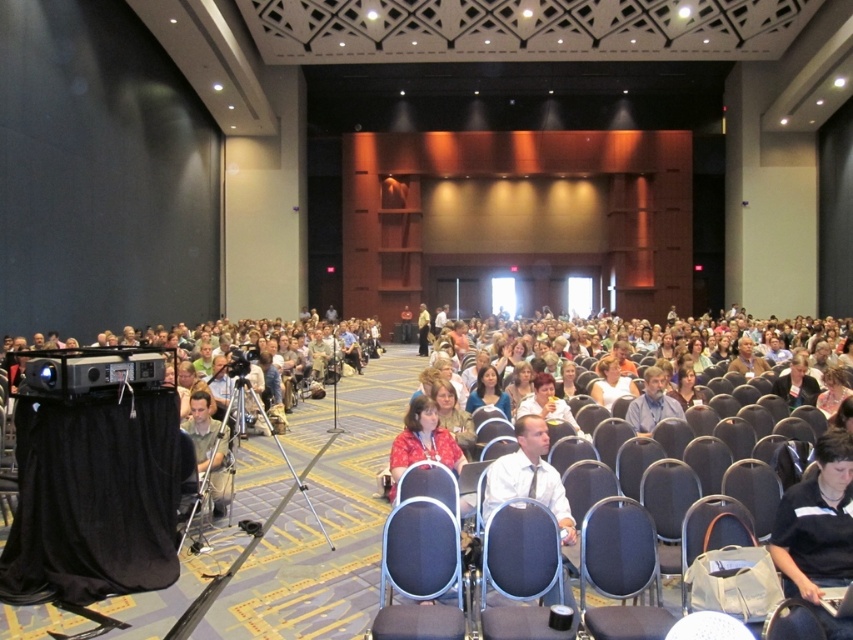
Question: Can you confirm if dark blue fabric chair at center is thinner than white shirt at center?

Choices:
 (A) no
 (B) yes

Answer: (A)

Question: Is black fabric chair at center further to camera compared to gray fabric chair at lower right?

Choices:
 (A) yes
 (B) no

Answer: (B)

Question: Among these points, which one is farthest from the camera?

Choices:
 (A) (189, 406)
 (B) (770, 512)
 (C) (422, 612)

Answer: (A)

Question: Which of the following is the farthest from the observer?

Choices:
 (A) matte black chair at lower right
 (B) gray fabric chair at lower right
 (C) matte blue chair at center

Answer: (A)

Question: Is gray fabric chair at lower right closer to the viewer compared to matte black chair at lower right?

Choices:
 (A) yes
 (B) no

Answer: (A)

Question: Based on their relative distances, which object is nearer to the matte black chair at lower right?

Choices:
 (A) dark blue fabric chair at center
 (B) matte blue chair at center

Answer: (A)